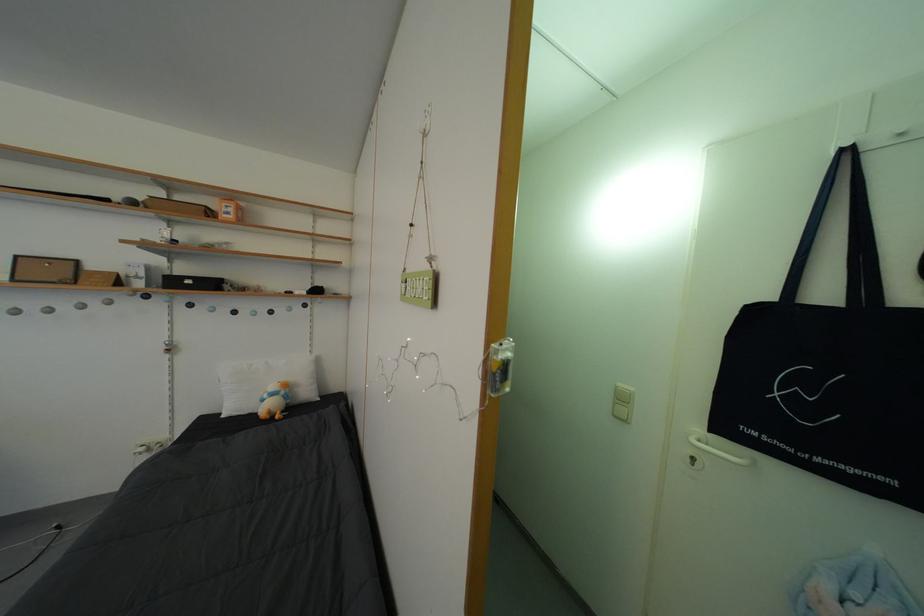
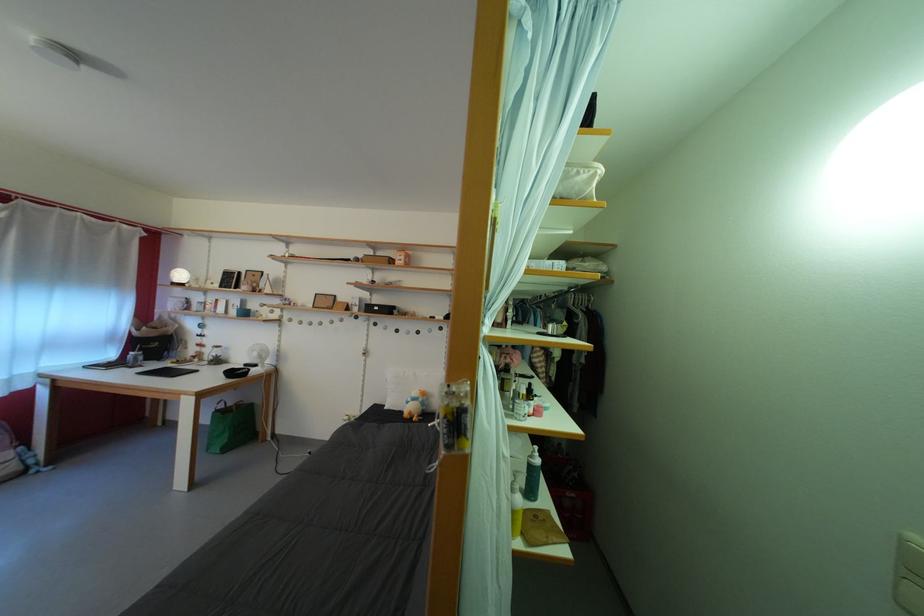
The point at (274,400) is marked in the first image. Where is the corresponding point in the second image?

(418, 405)